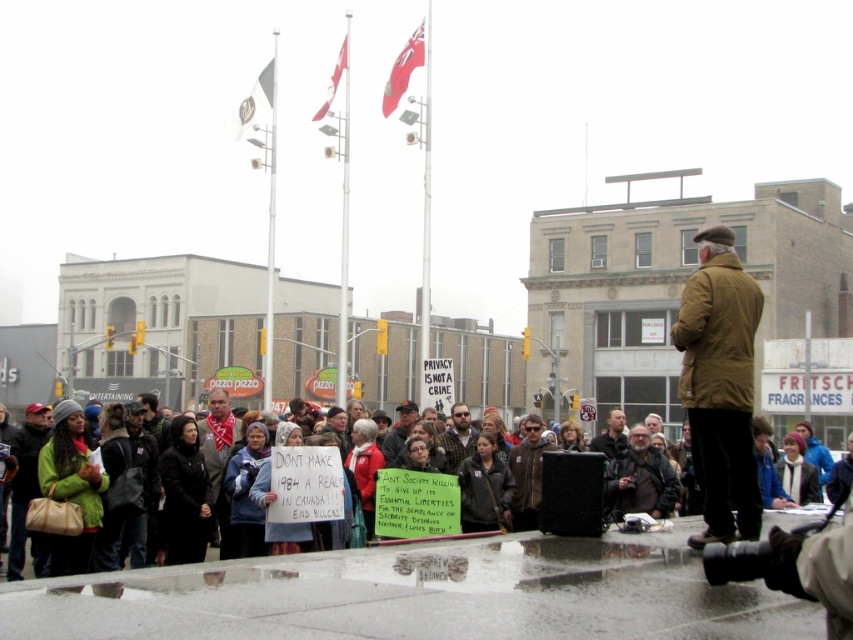
Can you confirm if brown leather jacket at center is wider than bearded man at center?

Indeed, brown leather jacket at center has a greater width compared to bearded man at center.

This screenshot has width=853, height=640. What do you see at coordinates (720, 385) in the screenshot?
I see `brown leather jacket at center` at bounding box center [720, 385].

Where is `brown leather jacket at center`? This screenshot has width=853, height=640. brown leather jacket at center is located at coordinates (720, 385).

In order to click on brown leather jacket at center in this screenshot , I will do `click(720, 385)`.

Based on the photo, does green fabric jacket at lower left have a smaller size compared to gray wool scarf at center?

Yes.

Which is behind, point (26, 460) or point (218, 433)?

Point (218, 433)

What do you see at coordinates (25, 481) in the screenshot?
I see `green fabric jacket at lower left` at bounding box center [25, 481].

You are a GUI agent. You are given a task and a screenshot of the screen. Output one action in this format:
    pyautogui.click(x=<x>, y=<y>)
    Task: Click on the green fabric jacket at lower left
    This screenshot has width=853, height=640.
    Given the screenshot: What is the action you would take?
    pyautogui.click(x=25, y=481)

Consider the image. Between dark brown leather jacket at center and gray wool scarf at center, which one is positioned higher?

dark brown leather jacket at center is higher up.

Measure the distance between dark brown leather jacket at center and camera.

10.07 meters

Locate an element on the screen. The width and height of the screenshot is (853, 640). dark brown leather jacket at center is located at coordinates (640, 477).